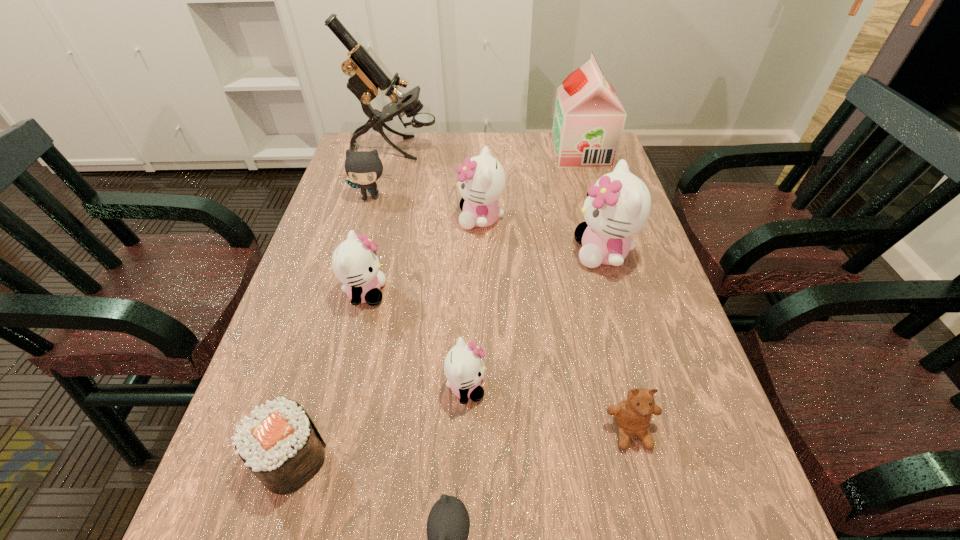
Identify the location of empty location between the nearest white kitten and the teddy bear. (548, 409).

Locate an element on the screen. The height and width of the screenshot is (540, 960). free spot between the sushi and the soya milk is located at coordinates (436, 306).

Identify the location of free space between the tallest object and the nearest white kitten. (430, 268).

Find the location of a particular element. This screenshot has height=540, width=960. empty space between the leftmost white kitten and the microscope is located at coordinates (380, 221).

Locate an element on the screen. This screenshot has width=960, height=540. vacant space that's between the teddy bear and the fifth farthest kitten is located at coordinates (548, 409).

At what (x,y) coordinates should I click in order to perform the action: click on empty location between the seventh farthest object and the third tallest object. Please return your answer as a coordinate pair (x, y). The height and width of the screenshot is (540, 960). Looking at the image, I should click on (535, 320).

Where is `object that is the eighth closest one to the brown teddy bear`? object that is the eighth closest one to the brown teddy bear is located at coordinates (589, 118).

Identify which object is located as the fifth nearest to the nearest white kitten. Please provide its 2D coordinates. Your answer should be formatted as a tuple, i.e. [(x, y)], where the tuple contains the x and y coordinates of a point satisfying the conditions above.

[(618, 206)]

Where is `kitten object that ranks as the closest to the soya milk`? Image resolution: width=960 pixels, height=540 pixels. kitten object that ranks as the closest to the soya milk is located at coordinates (482, 180).

Locate an element on the screen. Image resolution: width=960 pixels, height=540 pixels. kitten object that ranks as the fifth closest to the smaller gray kitten is located at coordinates (364, 168).